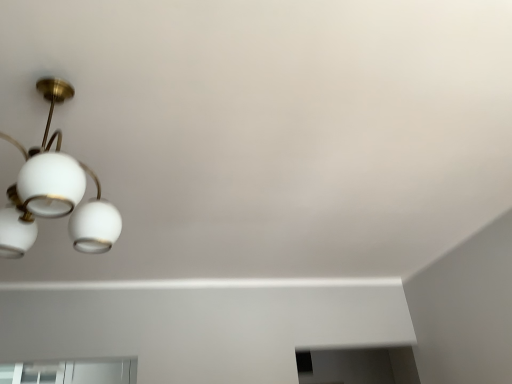
Question: Should I look upward or downward to see matte white chandelier at upper left?

Choices:
 (A) up
 (B) down

Answer: (A)